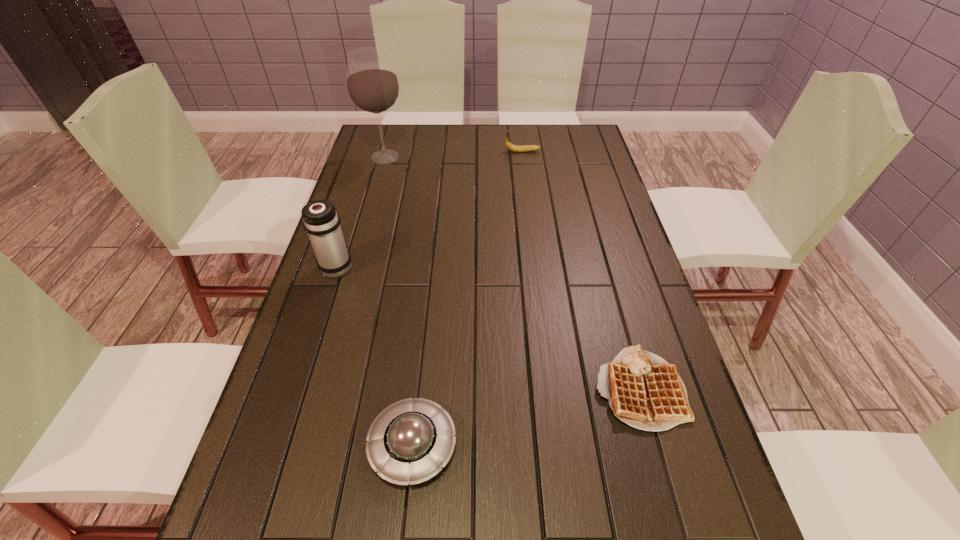
Where is `alcohol`? This screenshot has width=960, height=540. alcohol is located at coordinates (372, 84).

This screenshot has width=960, height=540. I want to click on thermos bottle, so click(321, 221).

The width and height of the screenshot is (960, 540). I want to click on the third nearest object, so click(x=321, y=221).

You are a GUI agent. You are given a task and a screenshot of the screen. Output one action in this format:
    pyautogui.click(x=<x>, y=<y>)
    Task: Click on the banana
    This screenshot has height=540, width=960.
    Given the screenshot: What is the action you would take?
    pyautogui.click(x=509, y=146)

This screenshot has width=960, height=540. Identify the location of the third object from left to right. (410, 441).

The height and width of the screenshot is (540, 960). Identify the location of the rightmost object. (644, 391).

The image size is (960, 540). Identify the location of the shortest object. (644, 391).

You are a GUI agent. You are given a task and a screenshot of the screen. Output one action in this format:
    pyautogui.click(x=<x>, y=<y>)
    Task: Click on the free space located on the front of the alcohol
    This screenshot has height=540, width=960.
    Given the screenshot: What is the action you would take?
    pyautogui.click(x=369, y=217)

Locate an element on the screen. free spot located on the side with the handle of the fourth shortest object is located at coordinates (367, 174).

What are the coordinates of `vacant space situated on the side with the handle of the fourth shortest object` in the screenshot? It's located at (354, 213).